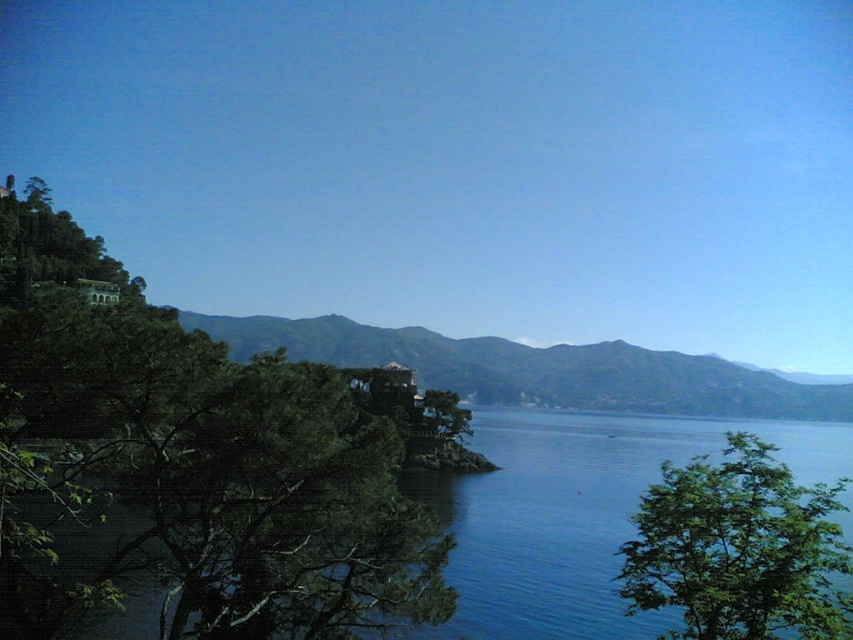
Question: From the image, what is the correct spatial relationship of green leafy tree at left in relation to green matte hillside at center?

Choices:
 (A) below
 (B) above

Answer: (B)

Question: Observing the image, what is the correct spatial positioning of green leafy tree at lower right in reference to green matte hillside at center?

Choices:
 (A) right
 (B) left

Answer: (B)

Question: Which object is closer to the camera taking this photo?

Choices:
 (A) green leafy tree at lower right
 (B) green matte hillside at center

Answer: (A)

Question: Which point is farther to the camera?

Choices:
 (A) green leafy tree at left
 (B) green matte hillside at center
 (C) green leafy tree at lower right

Answer: (B)

Question: Which point is farther to the camera?

Choices:
 (A) green leafy tree at left
 (B) green matte hillside at center
 (C) green leafy tree at lower right

Answer: (B)

Question: Can you confirm if green leafy tree at lower right is wider than green matte hillside at center?

Choices:
 (A) yes
 (B) no

Answer: (B)